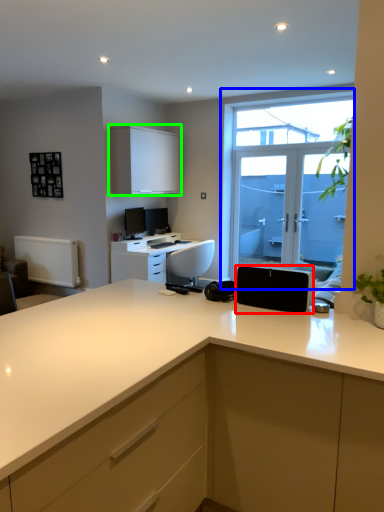
Question: Considering the real-world distances, which object is farthest from appliance (highlighted by a red box)? window (highlighted by a blue box) or cabinetry (highlighted by a green box)?

Choices:
 (A) window
 (B) cabinetry

Answer: (B)